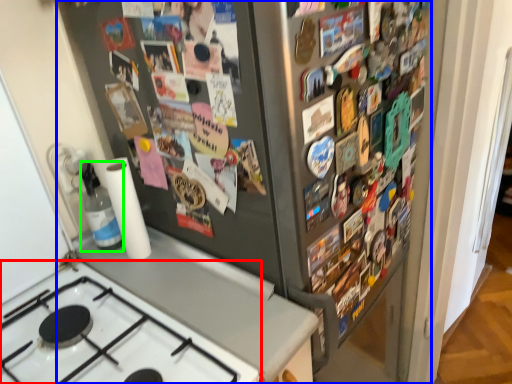
Question: Which is nearer to the gas stove (highlighted by a red box)? refrigerator (highlighted by a blue box) or bottle (highlighted by a green box).

Choices:
 (A) refrigerator
 (B) bottle

Answer: (B)